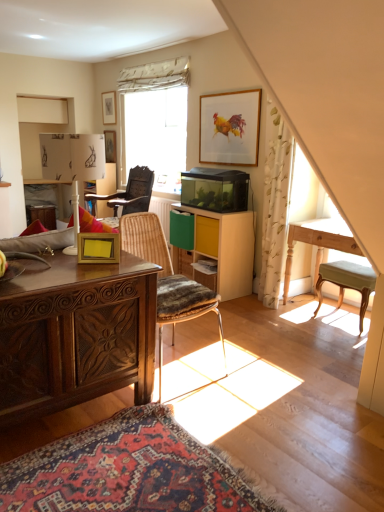
This screenshot has width=384, height=512. Identify the location of free spot in front of light wood table at right. (326, 343).